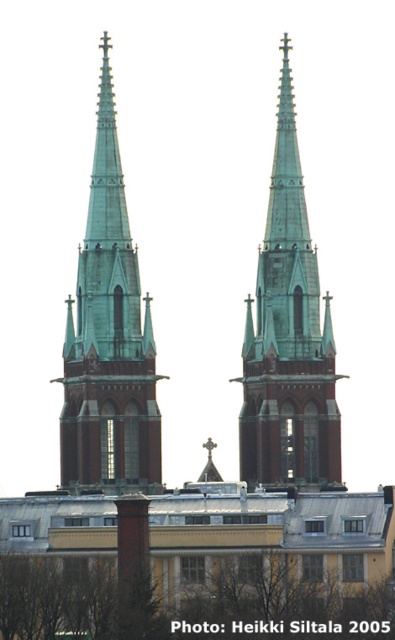
This screenshot has width=395, height=640. What do you see at coordinates (109, 337) in the screenshot? I see `green copper spire at center` at bounding box center [109, 337].

Does green copper spire at center appear over brown leafy tree at lower center?

Yes, green copper spire at center is above brown leafy tree at lower center.

What do you see at coordinates (109, 337) in the screenshot? I see `green copper spire at center` at bounding box center [109, 337].

The height and width of the screenshot is (640, 395). I want to click on green copper spire at center, so click(x=109, y=337).

Does green copper steeple at center have a smaller size compared to brown leafy tree at lower center?

Actually, green copper steeple at center might be larger than brown leafy tree at lower center.

Is green copper steeple at center positioned before brown leafy tree at lower center?

No.

What do you see at coordinates (287, 337) in the screenshot? This screenshot has height=640, width=395. I see `green copper steeple at center` at bounding box center [287, 337].

Find the location of a particular element. The image size is (395, 640). green copper steeple at center is located at coordinates (287, 337).

Can you confirm if green copper spire at center is bigger than green copper steeple at center?

Indeed, green copper spire at center has a larger size compared to green copper steeple at center.

Is point (86, 364) closer to camera compared to point (285, 115)?

Yes, point (86, 364) is in front of point (285, 115).

Does point (118, 152) lie behind point (255, 467)?

Yes, point (118, 152) is behind point (255, 467).

This screenshot has height=640, width=395. Identify the location of green copper spire at center. (109, 337).